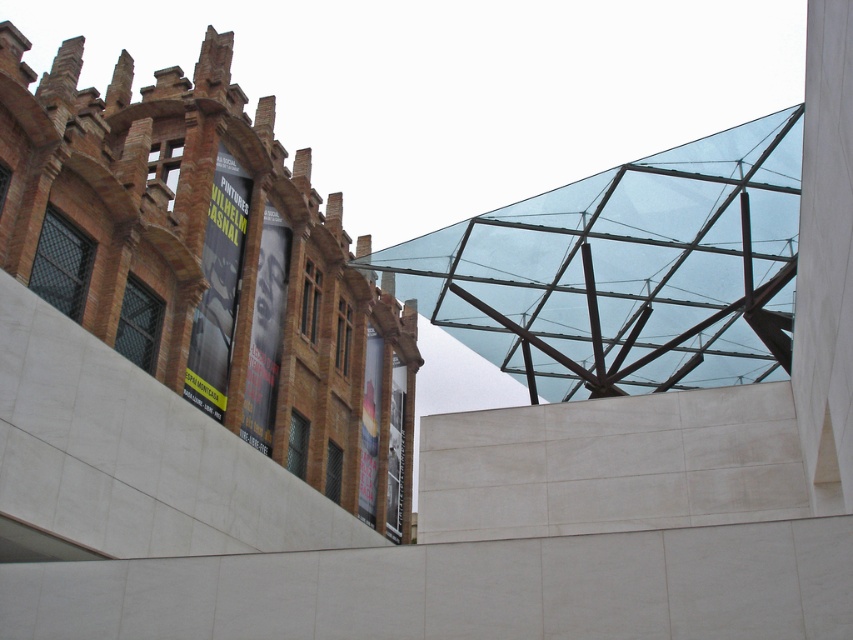
Does transparent glass pyramid at upper center appear over transparent glass roof at upper center?

Yes, transparent glass pyramid at upper center is above transparent glass roof at upper center.

From the picture: Is transparent glass pyramid at upper center taller than transparent glass roof at upper center?

Yes, transparent glass pyramid at upper center is taller than transparent glass roof at upper center.

Does point (157, 257) lie in front of point (641, 211)?

No.

Where is `transparent glass pyramid at upper center`? The image size is (853, 640). transparent glass pyramid at upper center is located at coordinates (210, 266).